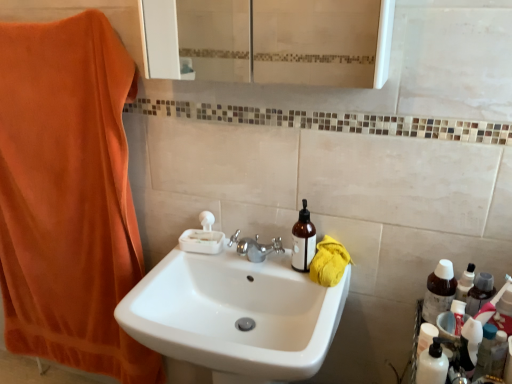
Question: Is white glossy sink at center bigger or smaller than orange plush towel at left, which is counted as the 2th beach towel, starting from the bottom?

Choices:
 (A) small
 (B) big

Answer: (B)

Question: From a real-world perspective, is white glossy sink at center physically located above or below orange plush towel at left, arranged as the 1th beach towel when viewed from the left?

Choices:
 (A) below
 (B) above

Answer: (A)

Question: Estimate the real-world distances between objects in this image. Which object is closer to the yellow cotton towel at right, acting as the first beach towel starting from the bottom?

Choices:
 (A) white glossy sink at center
 (B) matte brown bottle at center, marked as the 2th bottle in a right-to-left arrangement
 (C) white opaque bottle at lower right
 (D) orange plush towel at left, arranged as the 1th beach towel when viewed from the left
 (E) white glossy bottle at right

Answer: (B)

Question: Which of these objects is positioned closest to the matte brown bottle at center, arranged as the first bottle when viewed from the left?

Choices:
 (A) white glossy sink at center
 (B) white glossy bottle at right
 (C) orange plush towel at left, placed as the 2th beach towel when sorted from right to left
 (D) yellow cotton towel at right, marked as the 2th beach towel in a left-to-right arrangement
 (E) brown matte bottle at right, which is counted as the first bottle, starting from the right

Answer: (D)